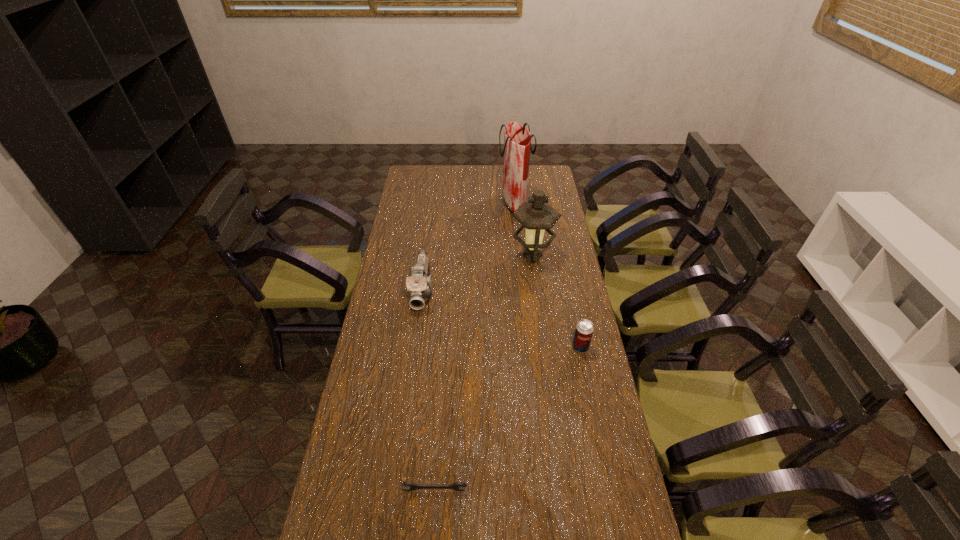
Image resolution: width=960 pixels, height=540 pixels. I want to click on the farthest object, so click(517, 140).

I want to click on grocery bag, so click(x=517, y=140).

In order to click on the second farthest object in this screenshot , I will do pyautogui.click(x=536, y=215).

Identify the location of oil lamp. (536, 215).

Find the location of a particular element. The image size is (960, 540). the third shortest object is located at coordinates (419, 285).

Image resolution: width=960 pixels, height=540 pixels. Identify the location of the third farthest object. (419, 285).

The image size is (960, 540). I want to click on the fourth farthest object, so point(584,329).

Identify the location of the fourth tallest object. (584, 329).

The width and height of the screenshot is (960, 540). What are the coordinates of `the nearest object` in the screenshot? It's located at (456, 486).

The height and width of the screenshot is (540, 960). I want to click on wrench, so click(456, 486).